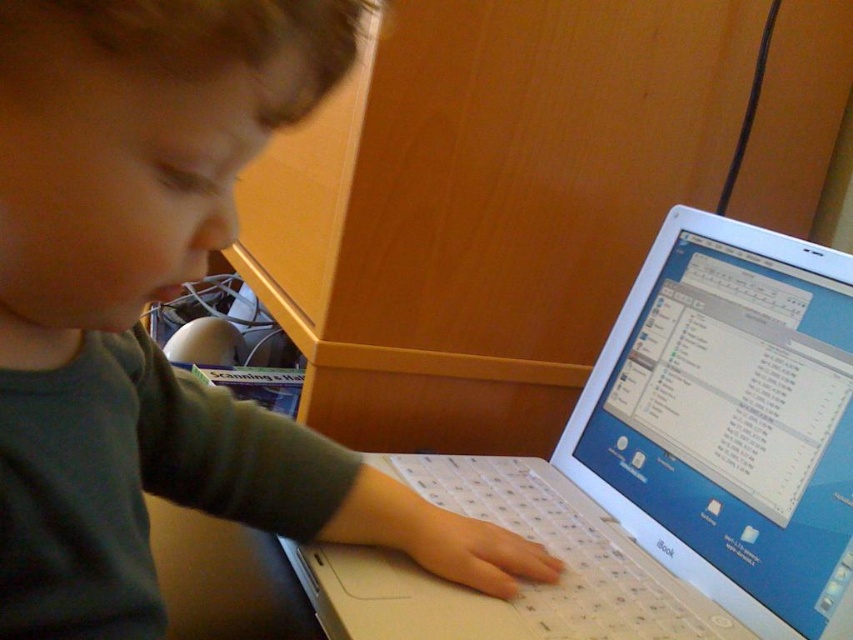
You are a photographer setting up a shot of the child and the laptop. You need to ensure that the gray matte shirt at upper left and the white plastic laptop at center are both clearly visible. Given their sizes, which object might require more careful framing to avoid being too small in the photo?

The gray matte shirt at upper left is smaller than the white plastic laptop at center, so it might require more careful framing to ensure it is not too small in the photo.

You are a photographer trying to capture a clear shot of the white plastic laptop at center. However, the gray matte shirt at upper left is blocking your view. Can you move the shirt to get an unobstructed view of the laptop?

The gray matte shirt at upper left is in front of the white plastic laptop at center, so moving the shirt would allow an unobstructed view of the laptop.

You are a photographer trying to capture a clear shot of the white plastic laptop at center without the gray matte shirt at upper left blocking the view. Based on their relative heights, can you position yourself in a way to avoid the shirt obscuring the laptop?

The gray matte shirt at upper left has a lesser height compared to the white plastic laptop at center, so positioning yourself lower or closer to the laptop would allow you to capture the white plastic laptop at center without the gray matte shirt at upper left blocking the view.